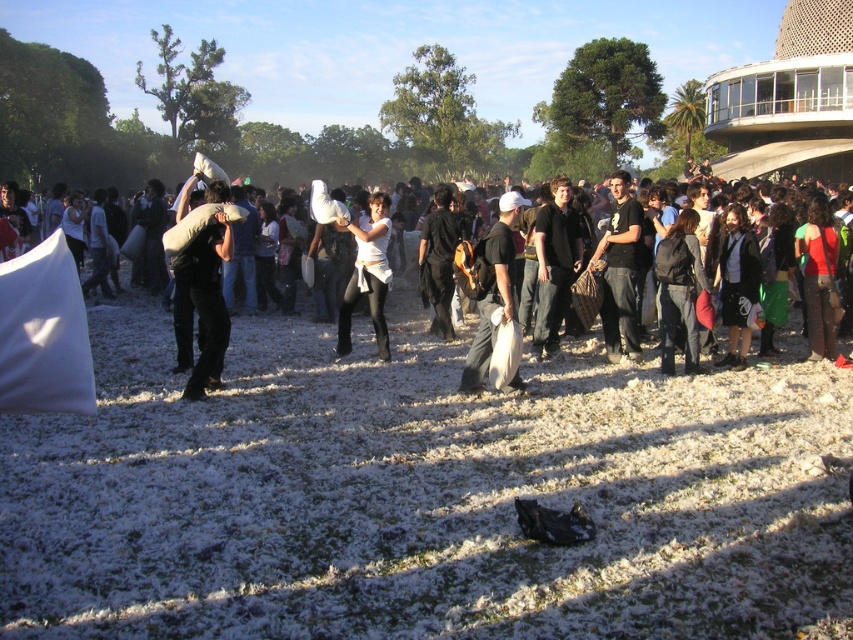
Question: Can you confirm if matte black bag at center is wider than white matte shirt at center?

Choices:
 (A) yes
 (B) no

Answer: (B)

Question: Does white fabric pillow at center have a smaller size compared to white matte shirt at center?

Choices:
 (A) no
 (B) yes

Answer: (A)

Question: Does matte black bag at center have a smaller size compared to black leather jacket at center?

Choices:
 (A) no
 (B) yes

Answer: (A)

Question: Which object is farther from the camera taking this photo?

Choices:
 (A) black cotton shirt at center
 (B) dark brown leather jacket at center-right
 (C) dark brown leather jacket at center
 (D) white cotton pillow at left

Answer: (C)

Question: Which point is closer to the camera?

Choices:
 (A) black leather jacket at center
 (B) white matte shirt at center

Answer: (A)

Question: Which point appears farthest from the camera in this image?

Choices:
 (A) (689, 252)
 (B) (497, 269)

Answer: (A)